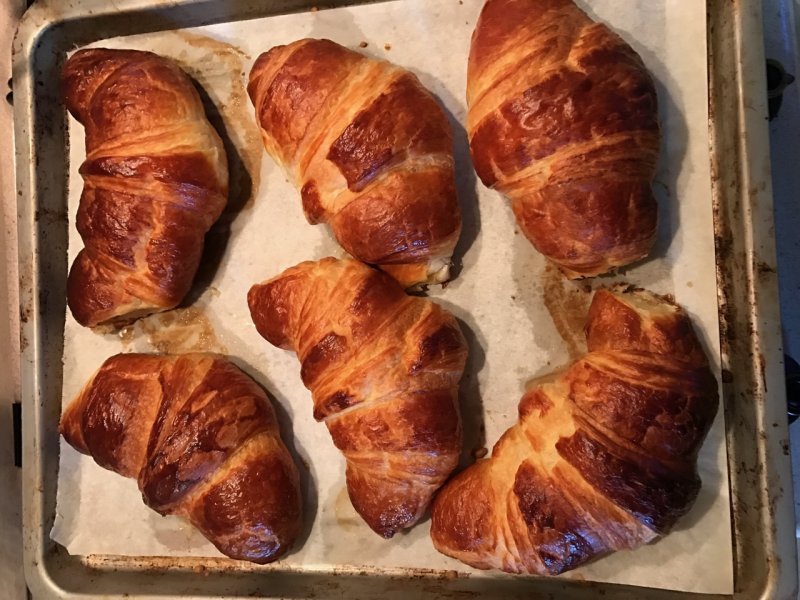
Find the location of a particular element. Image resolution: width=800 pixels, height=600 pixels. table top is located at coordinates (784, 182).